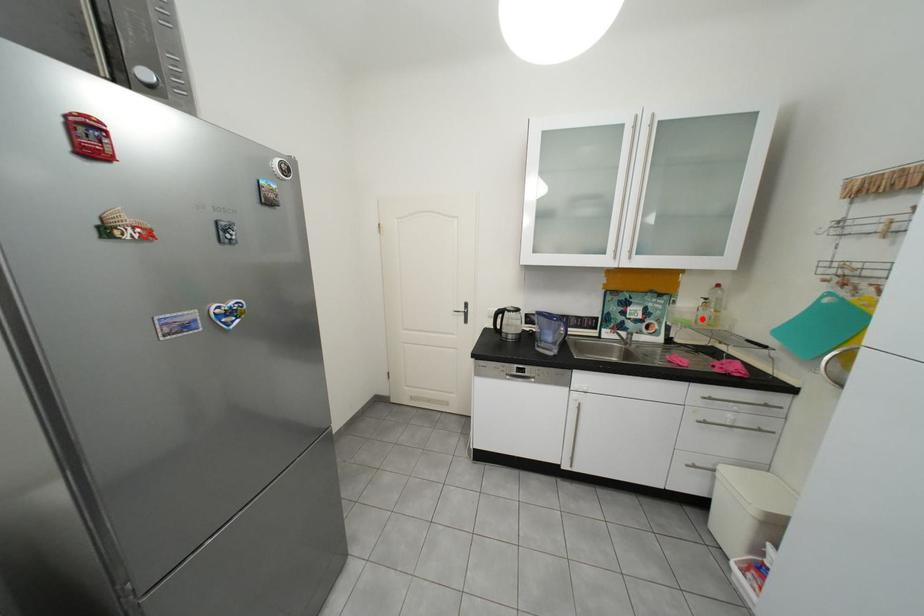
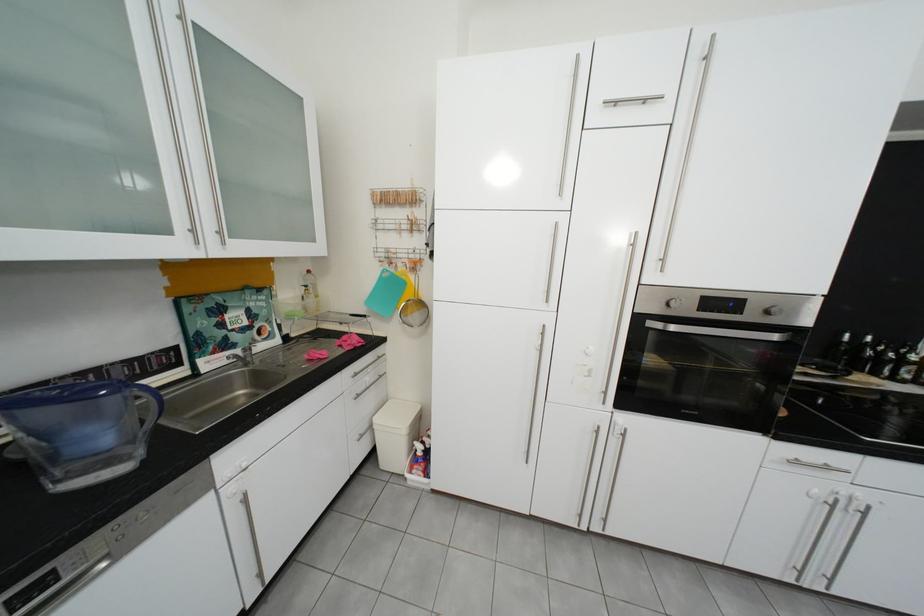
Where in the second image is the point corresponding to the highlighted location from the first image?

(311, 310)